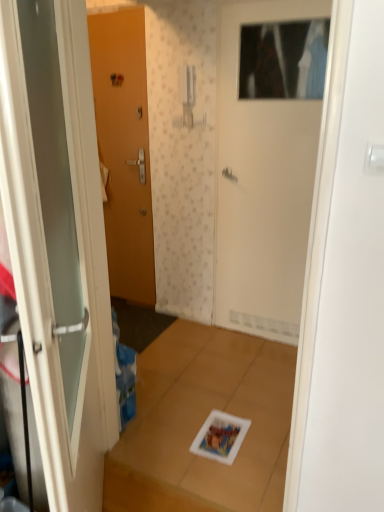
Question: Is white glossy door at left, acting as the second door starting from the left, thinner than matte wood door at left, which is the third door from front to back?

Choices:
 (A) yes
 (B) no

Answer: (B)

Question: Can you confirm if white glossy door at left, the 3th door positioned from the back, is positioned to the left of matte wood door at left, which is the third door from front to back?

Choices:
 (A) no
 (B) yes

Answer: (A)

Question: Does white glossy door at left, acting as the second door starting from the left, have a lesser height compared to matte wood door at left, the third door when ordered from right to left?

Choices:
 (A) yes
 (B) no

Answer: (A)

Question: Is white glossy door at left, the 3th door positioned from the back, facing away from matte wood door at left, the third door when ordered from right to left?

Choices:
 (A) yes
 (B) no

Answer: (B)

Question: Does white glossy door at left, the second door viewed from the right, have a smaller size compared to matte wood door at left, which is the third door from front to back?

Choices:
 (A) no
 (B) yes

Answer: (A)

Question: Is white glossy door at left, the 3th door positioned from the back, surrounding matte wood door at left, the third door when ordered from right to left?

Choices:
 (A) yes
 (B) no

Answer: (B)

Question: Is white matte door at upper center, which is the 2th door in back-to-front order, smaller than white glossy door at left, acting as the second door starting from the left?

Choices:
 (A) yes
 (B) no

Answer: (A)

Question: From the image's perspective, is white matte door at upper center, the 1th door positioned from the right, under white glossy door at left, the 3th door positioned from the back?

Choices:
 (A) no
 (B) yes

Answer: (A)

Question: From a real-world perspective, is white matte door at upper center, the 3th door positioned from the left, on top of white glossy door at left, acting as the second door starting from the left?

Choices:
 (A) yes
 (B) no

Answer: (A)

Question: Is white matte door at upper center, which is the 2th door in back-to-front order, facing towards white glossy door at left, which is the first door from front to back?

Choices:
 (A) yes
 (B) no

Answer: (A)

Question: Is there a large distance between white matte door at upper center, the 3th door positioned from the left, and white glossy door at left, the second door viewed from the right?

Choices:
 (A) yes
 (B) no

Answer: (A)

Question: From a real-world perspective, is white matte door at upper center, the 1th door positioned from the right, beneath white glossy door at left, acting as the second door starting from the left?

Choices:
 (A) yes
 (B) no

Answer: (B)

Question: Is white glossy door at left, the second door viewed from the right, bigger than white matte door at upper center, the 3th door positioned from the left?

Choices:
 (A) no
 (B) yes

Answer: (B)